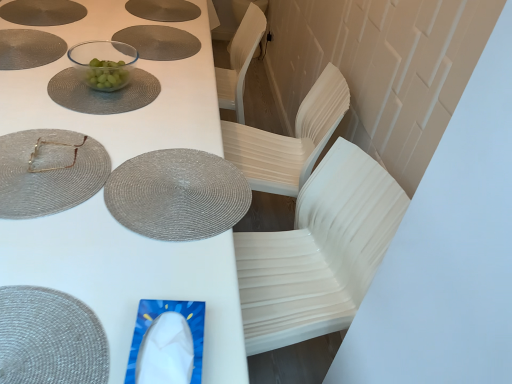
The image size is (512, 384). What do you see at coordinates (49, 338) in the screenshot?
I see `rattan placemat at lower left, the fourth tableware when ordered from top to bottom` at bounding box center [49, 338].

Consider the image. What is the approximate width of matte gray placemat at upper center, which appears as the first plate when viewed from the right?

matte gray placemat at upper center, which appears as the first plate when viewed from the right, is 13.44 inches in width.

Find the location of `transparent glass bowl at upper center, which is the second glass plate in bottom-to-top order`. transparent glass bowl at upper center, which is the second glass plate in bottom-to-top order is located at coordinates (103, 93).

At what (x,y) coordinates should I click in order to perform the action: click on gold metallic square at upper left, placed as the 3th tableware when sorted from bottom to top. Please return your answer as a coordinate pair (x, y). Image resolution: width=512 pixels, height=384 pixels. Looking at the image, I should click on (55, 145).

Image resolution: width=512 pixels, height=384 pixels. Describe the element at coordinates (55, 145) in the screenshot. I see `gold metallic square at upper left, which is the 3th tableware in front-to-back order` at that location.

What do you see at coordinates (29, 48) in the screenshot? I see `matte gray placemat at upper left, the first plate from the left` at bounding box center [29, 48].

At what (x,y) coordinates should I click in order to perform the action: click on clear glass bowl at upper center, which appears as the fourth tableware when viewed from the front. Please return your answer as a coordinate pair (x, y). The image size is (512, 384). Looking at the image, I should click on [103, 63].

Is matte woven placemat at upper left, arranged as the 1th glass plate when ordered from the bottom, at the back of transparent glass bowl at upper center, which is the second glass plate from front to back?

No, transparent glass bowl at upper center, which is the second glass plate from front to back, is not facing away from matte woven placemat at upper left, arranged as the 1th glass plate when ordered from the bottom.

From the image's perspective, which one is positioned lower, transparent glass bowl at upper center, which is the second glass plate from front to back, or matte woven placemat at upper left, arranged as the 1th glass plate when ordered from the bottom?

matte woven placemat at upper left, arranged as the 1th glass plate when ordered from the bottom, appears lower in the image.

Considering the positions of points (83, 100) and (99, 144), is point (83, 100) farther from camera compared to point (99, 144)?

Yes, point (83, 100) is behind point (99, 144).

Consider the image. Could you measure the distance between matte silver placemat at upper left, the 2th platter viewed from the right, and clear glass bowl at upper center, marked as the first tableware in a back-to-front arrangement?

They are 16.20 inches apart.

Would you say clear glass bowl at upper center, marked as the first tableware in a back-to-front arrangement, is part of matte silver placemat at upper left, the 2th platter viewed from the right,'s contents?

No.

Can you confirm if matte silver placemat at upper left, the 2th platter viewed from the right, is positioned to the left of clear glass bowl at upper center, which appears as the fourth tableware when viewed from the front?

Indeed, matte silver placemat at upper left, the 2th platter viewed from the right, is positioned on the left side of clear glass bowl at upper center, which appears as the fourth tableware when viewed from the front.

From a real-world perspective, which object rests below the other?

In real-world perspective, matte silver placemat at upper left, the 1th platter in the left-to-right sequence, is lower.

Is matte silver placemat at upper left, the 1th platter in the left-to-right sequence, positioned in front of matte gray placemat at upper center, which is the 1th platter from right to left?

Yes, it is.

Is matte silver placemat at upper left, the 2th platter viewed from the right, shorter than matte gray placemat at upper center, which is counted as the 2th platter, starting from the left?

In fact, matte silver placemat at upper left, the 2th platter viewed from the right, may be taller than matte gray placemat at upper center, which is counted as the 2th platter, starting from the left.

How distant is matte silver placemat at upper left, the 2th platter viewed from the right, from matte gray placemat at upper center, which is counted as the 2th platter, starting from the left?

matte silver placemat at upper left, the 2th platter viewed from the right, is 14.92 inches away from matte gray placemat at upper center, which is counted as the 2th platter, starting from the left.

Is matte silver placemat at upper left, the 2th platter viewed from the right, touching matte gray placemat at upper center, which is the 1th platter from right to left?

No, matte silver placemat at upper left, the 2th platter viewed from the right, is not in contact with matte gray placemat at upper center, which is the 1th platter from right to left.

Would you say matte gray placemat at upper center, which is counted as the 2th platter, starting from the left, contains clear glass bowl at upper center, marked as the 1th tableware in a top-to-bottom arrangement?

No, clear glass bowl at upper center, marked as the 1th tableware in a top-to-bottom arrangement, is not a part of matte gray placemat at upper center, which is counted as the 2th platter, starting from the left.

Considering their positions, is matte gray placemat at upper center, which is the 1th platter from right to left, located in front of or behind clear glass bowl at upper center, which appears as the fourth tableware when viewed from the front?

matte gray placemat at upper center, which is the 1th platter from right to left, is positioned farther from the viewer than clear glass bowl at upper center, which appears as the fourth tableware when viewed from the front.

Looking at this image, from the image's perspective, is matte gray placemat at upper center, which is the 1th platter from right to left, above clear glass bowl at upper center, marked as the first tableware in a back-to-front arrangement?

Yes, from the image's perspective, matte gray placemat at upper center, which is the 1th platter from right to left, is over clear glass bowl at upper center, marked as the first tableware in a back-to-front arrangement.

Which of these two, gold metallic square at upper left, the 2th tableware when ordered from top to bottom, or matte silver placemat at upper left, the 1th platter in the left-to-right sequence, is smaller?

gold metallic square at upper left, the 2th tableware when ordered from top to bottom.

Could you measure the distance between gold metallic square at upper left, which is the 3th tableware in front-to-back order, and matte silver placemat at upper left, the 1th platter in the left-to-right sequence?

gold metallic square at upper left, which is the 3th tableware in front-to-back order, is 94.84 centimeters away from matte silver placemat at upper left, the 1th platter in the left-to-right sequence.

Does gold metallic square at upper left, the 2th tableware when ordered from top to bottom, lie in front of matte silver placemat at upper left, the 1th platter in the left-to-right sequence?

Yes, gold metallic square at upper left, the 2th tableware when ordered from top to bottom, is closer to the camera.

Considering the sizes of objects gold metallic square at upper left, the 2th tableware when ordered from top to bottom, and matte silver placemat at upper left, the 2th platter viewed from the right, in the image provided, who is shorter, gold metallic square at upper left, the 2th tableware when ordered from top to bottom, or matte silver placemat at upper left, the 2th platter viewed from the right,?

matte silver placemat at upper left, the 2th platter viewed from the right, is shorter.

Between matte gray placemat at upper center, which appears as the first plate when viewed from the right, and transparent glass bowl at upper center, the first glass plate in the back-to-front sequence, which one appears on the left side from the viewer's perspective?

Positioned to the left is transparent glass bowl at upper center, the first glass plate in the back-to-front sequence.

Does matte gray placemat at upper center, which appears as the first plate when viewed from the right, have a larger size compared to transparent glass bowl at upper center, which is the second glass plate in bottom-to-top order?

Incorrect, matte gray placemat at upper center, which appears as the first plate when viewed from the right, is not larger than transparent glass bowl at upper center, which is the second glass plate in bottom-to-top order.

Which is closer, (149, 44) or (131, 86)?

The point (131, 86) is closer.

Based on the photo, can you confirm if matte gray placemat at upper center, which appears as the 2th plate when viewed from the left, is taller than transparent glass bowl at upper center, which is the second glass plate from front to back?

In fact, matte gray placemat at upper center, which appears as the 2th plate when viewed from the left, may be shorter than transparent glass bowl at upper center, which is the second glass plate from front to back.

Is matte gray placemat at upper center, which is counted as the 2th platter, starting from the left, taller than matte silver placemat at upper left, the 1th platter in the left-to-right sequence?

No.

Is matte gray placemat at upper center, which is counted as the 2th platter, starting from the left, outside of matte silver placemat at upper left, the 2th platter viewed from the right?

Yes, matte gray placemat at upper center, which is counted as the 2th platter, starting from the left, is outside of matte silver placemat at upper left, the 2th platter viewed from the right.

Is matte gray placemat at upper center, which is counted as the 2th platter, starting from the left, beside matte silver placemat at upper left, the 1th platter in the left-to-right sequence?

No, matte gray placemat at upper center, which is counted as the 2th platter, starting from the left, is not touching matte silver placemat at upper left, the 1th platter in the left-to-right sequence.

Which is more to the right, matte gray placemat at upper center, which is the 1th platter from right to left, or matte silver placemat at upper left, the 2th platter viewed from the right?

Positioned to the right is matte gray placemat at upper center, which is the 1th platter from right to left.

Locate an element on the screen. Image resolution: width=512 pixels, height=384 pixels. glass plate located on the right of matte woven placemat at upper left, which is the 2th glass plate from top to bottom is located at coordinates (103, 93).

Where is `the 2nd tableware above the matte silver placemat at upper left, the 1th platter in the left-to-right sequence (from a real-world perspective)`? the 2nd tableware above the matte silver placemat at upper left, the 1th platter in the left-to-right sequence (from a real-world perspective) is located at coordinates (103, 63).

Based on the photo, when comparing their distances from matte silver placemat at upper left, the 1th platter in the left-to-right sequence, does gold metallic square at upper left, which is the 3th tableware in front-to-back order, or silver textured placemat at center, which is counted as the 3th tableware, starting from the top, seem closer?

gold metallic square at upper left, which is the 3th tableware in front-to-back order, lies closer to matte silver placemat at upper left, the 1th platter in the left-to-right sequence, than the other object.

From the picture: When comparing their distances from gold metallic square at upper left, the 2th tableware when ordered from top to bottom, does matte gray placemat at upper center, which appears as the 2th plate when viewed from the left, or silver textured placemat at center, which is counted as the 3th tableware, starting from the top, seem closer?

The object closer to gold metallic square at upper left, the 2th tableware when ordered from top to bottom, is silver textured placemat at center, which is counted as the 3th tableware, starting from the top.

Estimate the real-world distances between objects in this image. Which object is closer to rattan placemat at lower left, arranged as the fourth tableware when viewed from the back, matte gray placemat at upper center, which appears as the 2th plate when viewed from the left, or matte silver placemat at upper left, the 2th platter viewed from the right?

matte gray placemat at upper center, which appears as the 2th plate when viewed from the left, is closer to rattan placemat at lower left, arranged as the fourth tableware when viewed from the back.

From the image, which object appears to be farther from matte silver placemat at upper left, the 1th platter in the left-to-right sequence, clear glass bowl at upper center, marked as the 1th tableware in a top-to-bottom arrangement, or transparent glass bowl at upper center, which is the second glass plate from front to back?

transparent glass bowl at upper center, which is the second glass plate from front to back, lies further to matte silver placemat at upper left, the 1th platter in the left-to-right sequence, than the other object.

From the image, which object appears to be farther from matte gray placemat at upper center, which is counted as the 2th platter, starting from the left, white plastic table at center or matte gray placemat at upper left, the first plate from the left?

white plastic table at center is positioned further to the anchor matte gray placemat at upper center, which is counted as the 2th platter, starting from the left.

Considering their positions, is white plastic table at center positioned closer to transparent glass bowl at upper center, which is the second glass plate from front to back, than gold metallic square at upper left, which is the 3th tableware in front-to-back order?

The object closer to transparent glass bowl at upper center, which is the second glass plate from front to back, is white plastic table at center.

When comparing their distances from clear glass bowl at upper center, placed as the fourth tableware when sorted from bottom to top, does matte woven placemat at upper left, arranged as the 1th glass plate when ordered from the bottom, or matte silver placemat at upper left, the 1th platter in the left-to-right sequence, seem further?

matte woven placemat at upper left, arranged as the 1th glass plate when ordered from the bottom, is positioned further to the anchor clear glass bowl at upper center, placed as the fourth tableware when sorted from bottom to top.

Which object lies nearer to the anchor point matte woven placemat at upper left, positioned as the second glass plate in back-to-front order, matte gray placemat at upper center, which is counted as the 2th platter, starting from the left, or silver textured placemat at center, which is counted as the 2th tableware, starting from the bottom?

Among the two, silver textured placemat at center, which is counted as the 2th tableware, starting from the bottom, is located nearer to matte woven placemat at upper left, positioned as the second glass plate in back-to-front order.

Where is `glass plate between silver textured placemat at center, which is the second tableware from front to back, and matte gray placemat at upper center, which appears as the 2th plate when viewed from the left, along the z-axis`? glass plate between silver textured placemat at center, which is the second tableware from front to back, and matte gray placemat at upper center, which appears as the 2th plate when viewed from the left, along the z-axis is located at coordinates (103, 93).

Where is `glass plate located between rattan placemat at lower left, the 1th tableware when ordered from front to back, and gold metallic square at upper left, the 2th tableware when ordered from back to front, in the depth direction`? glass plate located between rattan placemat at lower left, the 1th tableware when ordered from front to back, and gold metallic square at upper left, the 2th tableware when ordered from back to front, in the depth direction is located at coordinates (49, 172).

The height and width of the screenshot is (384, 512). In order to click on glass plate between matte silver placemat at upper left, the 2th platter viewed from the right, and gold metallic square at upper left, the 2th tableware when ordered from top to bottom, in the up-down direction in this screenshot , I will do `click(103, 93)`.

Where is `glass plate between rattan placemat at lower left, the first tableware ordered from the bottom, and silver textured placemat at center, which is counted as the 3th tableware, starting from the top, in the front-back direction`? glass plate between rattan placemat at lower left, the first tableware ordered from the bottom, and silver textured placemat at center, which is counted as the 3th tableware, starting from the top, in the front-back direction is located at coordinates (49, 172).